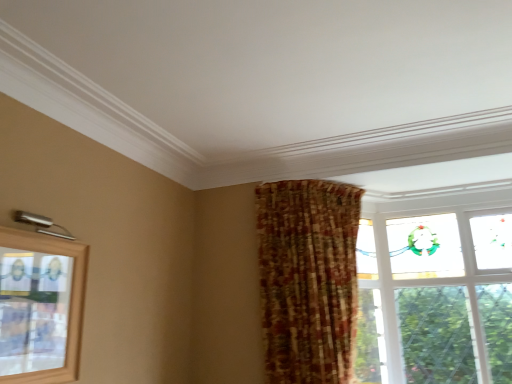
Question: Considering the positions of plaid fabric curtain at center and clear glass window at upper right, which appears as the 2th window when viewed from the front, in the image, is plaid fabric curtain at center wider or thinner than clear glass window at upper right, which appears as the 2th window when viewed from the front,?

Choices:
 (A) wide
 (B) thin

Answer: (A)

Question: Considering their positions, is plaid fabric curtain at center located in front of or behind clear glass window at upper right, placed as the first window when sorted from right to left?

Choices:
 (A) behind
 (B) front

Answer: (B)

Question: Which of these objects is positioned farthest from the clear glass window at upper left, placed as the 1th window when sorted from left to right?

Choices:
 (A) plaid fabric curtain at center
 (B) clear glass window at upper right, the 1th window positioned from the back

Answer: (B)

Question: Based on their relative distances, which object is farther from the clear glass window at upper left, which appears as the 1th window when viewed from the front?

Choices:
 (A) plaid fabric curtain at center
 (B) clear glass window at upper right, placed as the first window when sorted from right to left

Answer: (B)